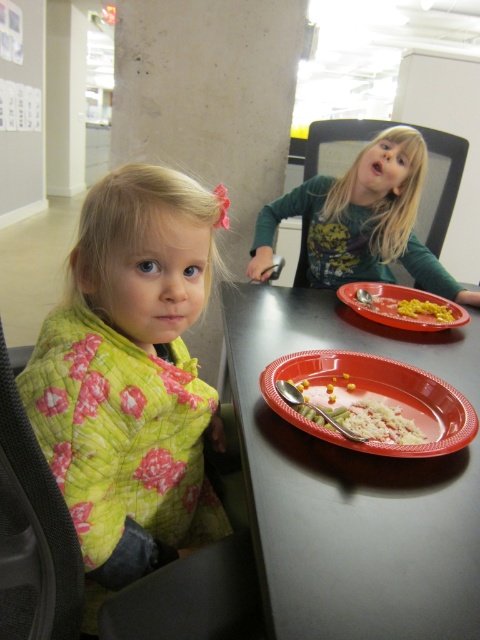
Question: Among these points, which one is nearest to the camera?

Choices:
 (A) (404, 310)
 (B) (360, 372)
 (C) (326, 387)
 (D) (348, 280)

Answer: (C)

Question: Does orange plastic plate at center come in front of matte plastic plate at center?

Choices:
 (A) no
 (B) yes

Answer: (B)

Question: Estimate the real-world distances between objects in this image. Which object is closer to the red plastic table at center?

Choices:
 (A) orange plastic plate at center
 (B) matte plastic plate at center
 (C) green textured shirt at upper right

Answer: (A)

Question: Where is green quilted blanket at left located in relation to green textured shirt at upper right in the image?

Choices:
 (A) below
 (B) above

Answer: (A)

Question: Which of the following is the closest to the observer?

Choices:
 (A) red plastic table at center
 (B) yellow matte corn at center
 (C) green quilted blanket at left

Answer: (A)

Question: Is white matte rice at center in front of matte plastic plate at center?

Choices:
 (A) no
 (B) yes

Answer: (B)